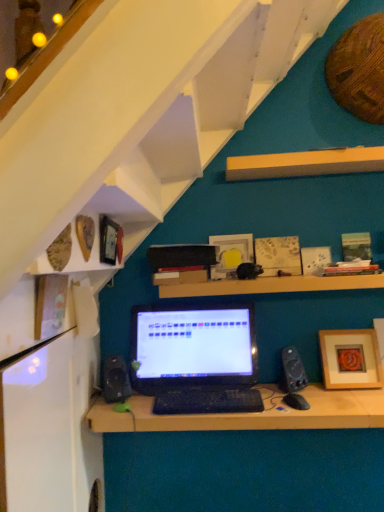
Locate an element on the screen. free space above wooden at center, the first shelf from the bottom (from a real-world perspective) is located at coordinates (271, 276).